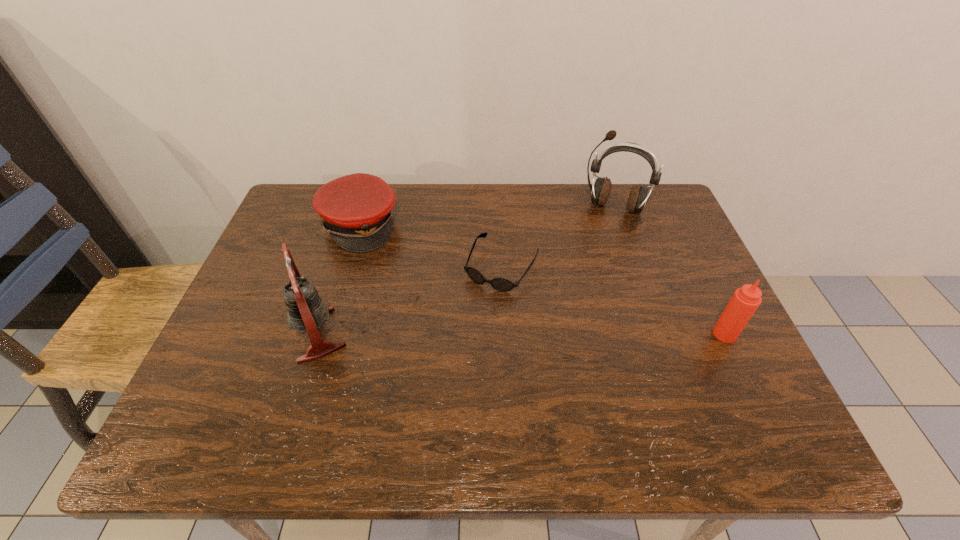
The image size is (960, 540). Identify the location of vacant space at the far left corner of the desktop. (294, 195).

The image size is (960, 540). I want to click on free space at the near left corner of the desktop, so click(261, 376).

This screenshot has height=540, width=960. Identify the location of free region at the far right corner of the desktop. (658, 233).

The width and height of the screenshot is (960, 540). What are the coordinates of `vacant area that lies between the earphone and the third shortest object` in the screenshot? It's located at (670, 271).

Find the location of a particular element. The height and width of the screenshot is (540, 960). free space between the third shortest object and the second shortest object is located at coordinates click(542, 280).

Locate an element on the screen. The width and height of the screenshot is (960, 540). vacant region between the bell and the sunglasses is located at coordinates (409, 301).

Where is `vacant space that's between the shortest object and the bell`? The height and width of the screenshot is (540, 960). vacant space that's between the shortest object and the bell is located at coordinates (409, 301).

Find the location of a particular element. blank region between the third tallest object and the earphone is located at coordinates (670, 271).

This screenshot has width=960, height=540. Identify the location of free space that is in between the earphone and the third tallest object. (670, 271).

The height and width of the screenshot is (540, 960). In order to click on free space between the third tallest object and the fourth object from left to right in this screenshot , I will do `click(670, 271)`.